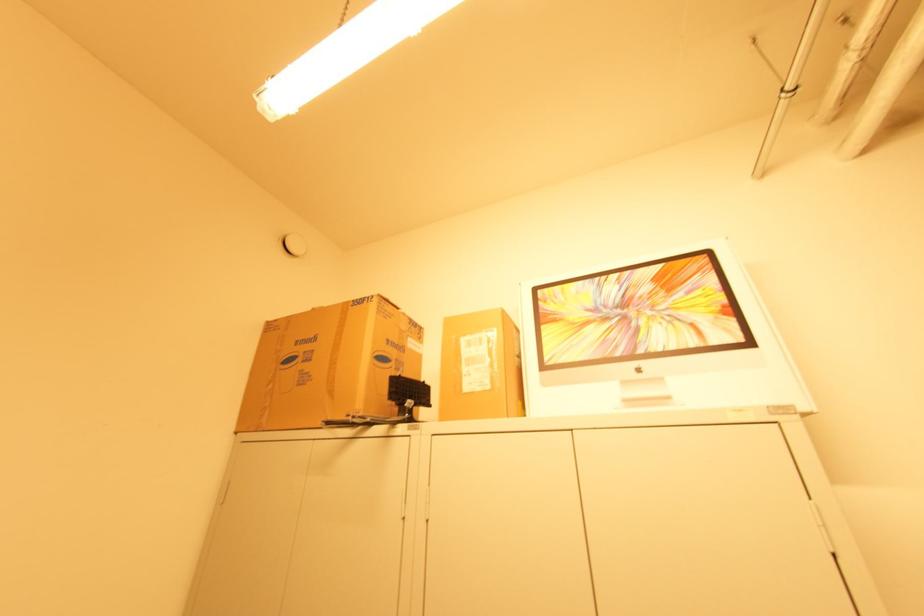
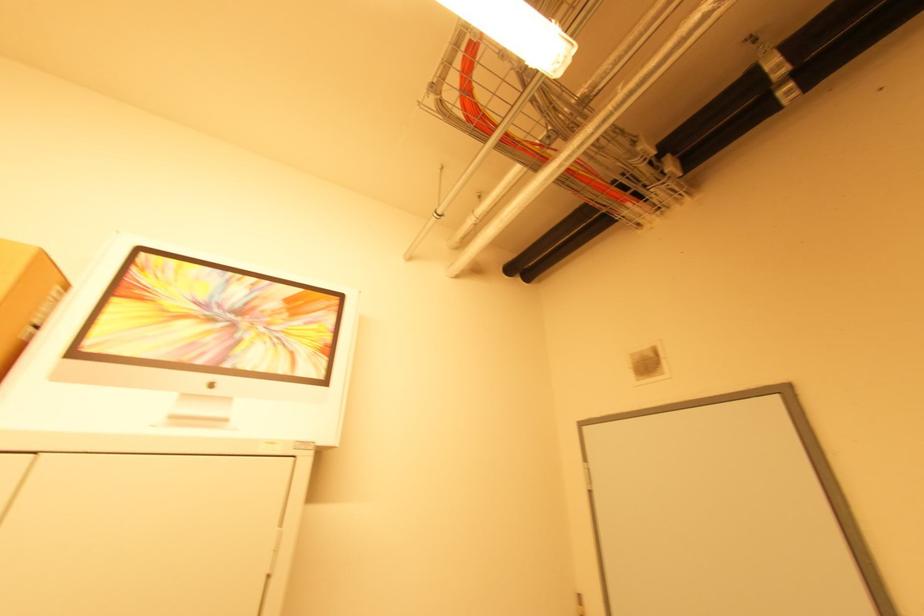
Where in the second image is the point corresponding to [545,326] from the first image?

(117, 300)